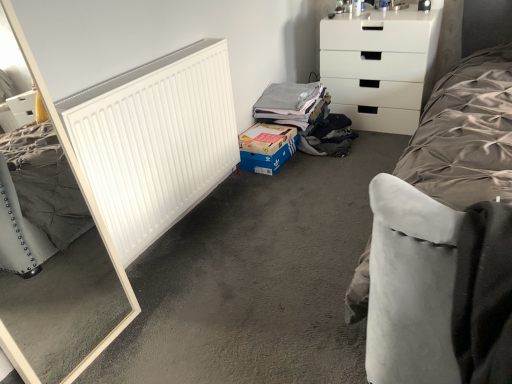
Question: Is point (257, 178) positioned closer to the camera than point (272, 132)?

Choices:
 (A) closer
 (B) farther

Answer: (A)

Question: Relative to cardboard box at lower center, is smooth gray carpet at center in front or behind?

Choices:
 (A) behind
 (B) front

Answer: (B)

Question: Estimate the real-world distances between objects in this image. Which object is closer to the white matte radiator at left?

Choices:
 (A) smooth gray carpet at center
 (B) cardboard box at lower center
 (C) white glossy chest of drawers at upper right

Answer: (A)

Question: Which of these objects is positioned farthest from the white glossy chest of drawers at upper right?

Choices:
 (A) cardboard box at lower center
 (B) white matte radiator at left
 (C) smooth gray carpet at center

Answer: (B)